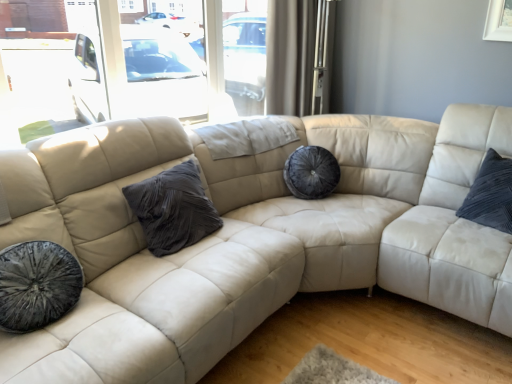
Question: Considering their positions, is white sheer curtain at upper center located in front of or behind velvet dark gray pillow at center?

Choices:
 (A) front
 (B) behind

Answer: (B)

Question: Is point (291, 51) positioned closer to the camera than point (158, 201)?

Choices:
 (A) closer
 (B) farther

Answer: (B)

Question: Is white sheer curtain at upper center wider or thinner than velvet dark gray pillow at center?

Choices:
 (A) thin
 (B) wide

Answer: (A)

Question: From the image's perspective, is velvet dark gray pillow at center located above or below white sheer curtain at upper center?

Choices:
 (A) below
 (B) above

Answer: (A)

Question: Would you say velvet dark gray pillow at center is inside or outside white sheer curtain at upper center?

Choices:
 (A) outside
 (B) inside

Answer: (A)

Question: From their relative heights in the image, would you say velvet dark gray pillow at center is taller or shorter than white sheer curtain at upper center?

Choices:
 (A) tall
 (B) short

Answer: (B)

Question: Relative to white sheer curtain at upper center, is velvet dark gray pillow at center in front or behind?

Choices:
 (A) front
 (B) behind

Answer: (A)